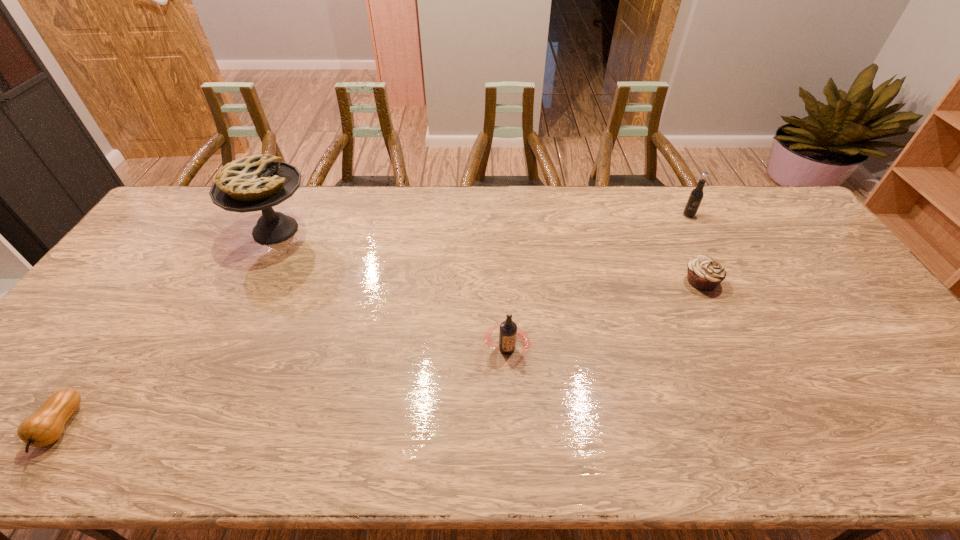
Locate an element on the screen. Image resolution: width=960 pixels, height=540 pixels. free location at the left edge of the desktop is located at coordinates (99, 339).

You are a GUI agent. You are given a task and a screenshot of the screen. Output one action in this format:
    pyautogui.click(x=<x>, y=<y>)
    Task: Click on the free space at the far right corner of the desktop
    
    Given the screenshot: What is the action you would take?
    pyautogui.click(x=786, y=218)

At what (x,y) coordinates should I click in order to perform the action: click on vacant area that lies between the gourd and the third object from left to right. Please return your answer as a coordinate pair (x, y). Looking at the image, I should click on (283, 388).

Find the location of a particular element. The image size is (960, 540). blank region between the right root beer and the third object from right to left is located at coordinates (598, 281).

You are a GUI agent. You are given a task and a screenshot of the screen. Output one action in this format:
    pyautogui.click(x=<x>, y=<y>)
    Task: Click on the free spot between the second object from left to right and the leftmost object
    The height and width of the screenshot is (540, 960).
    Given the screenshot: What is the action you would take?
    pyautogui.click(x=168, y=328)

Where is `vacant area that lies between the gourd and the shorter root beer`? vacant area that lies between the gourd and the shorter root beer is located at coordinates (283, 388).

This screenshot has width=960, height=540. Identify the location of free space that is in between the right root beer and the tallest object. tap(482, 222).

Where is `free spot between the nearest object and the muffin`? free spot between the nearest object and the muffin is located at coordinates (380, 354).

The image size is (960, 540). I want to click on vacant space that is in between the taller root beer and the nearest object, so point(374,321).

Find the location of a particular element. vacant area that lies between the tallest object and the third nearest object is located at coordinates (489, 255).